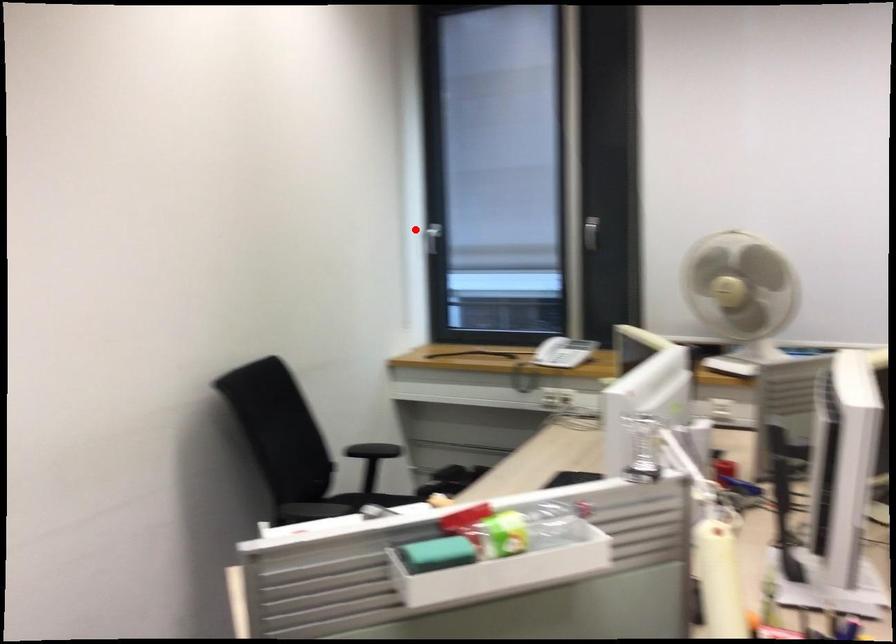
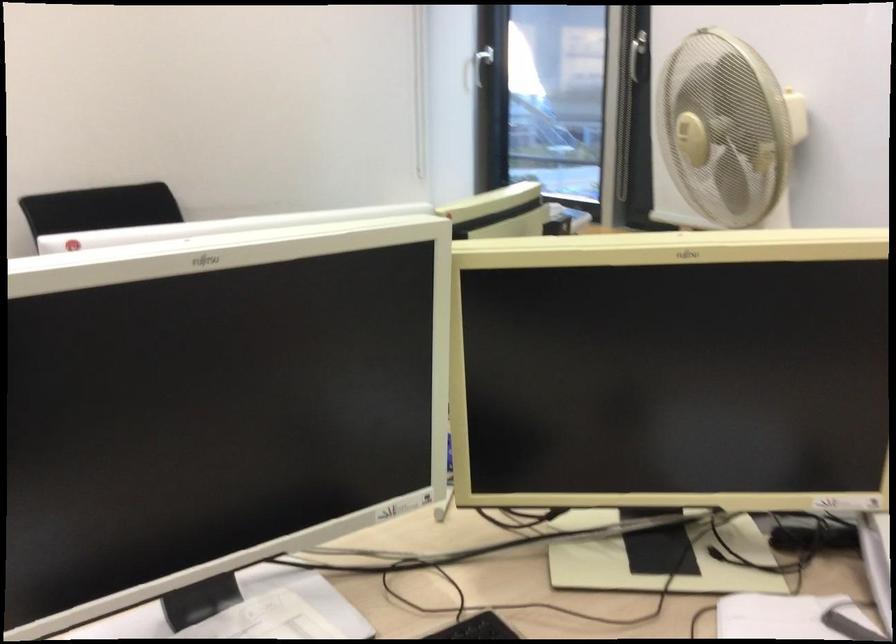
Question: I am providing you with two images of the same scene from different viewpoints. Given a red point in image1, look at the same physical point in image2. Is it:

Choices:
 (A) Closer to the viewpoint
 (B) Farther from the viewpoint

Answer: (A)